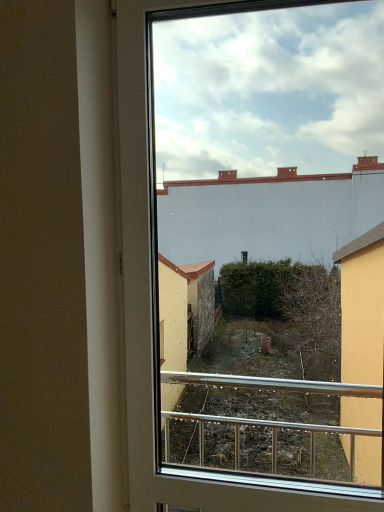
Question: Should I look upward or downward to see transparent glass window at center?

Choices:
 (A) down
 (B) up

Answer: (A)